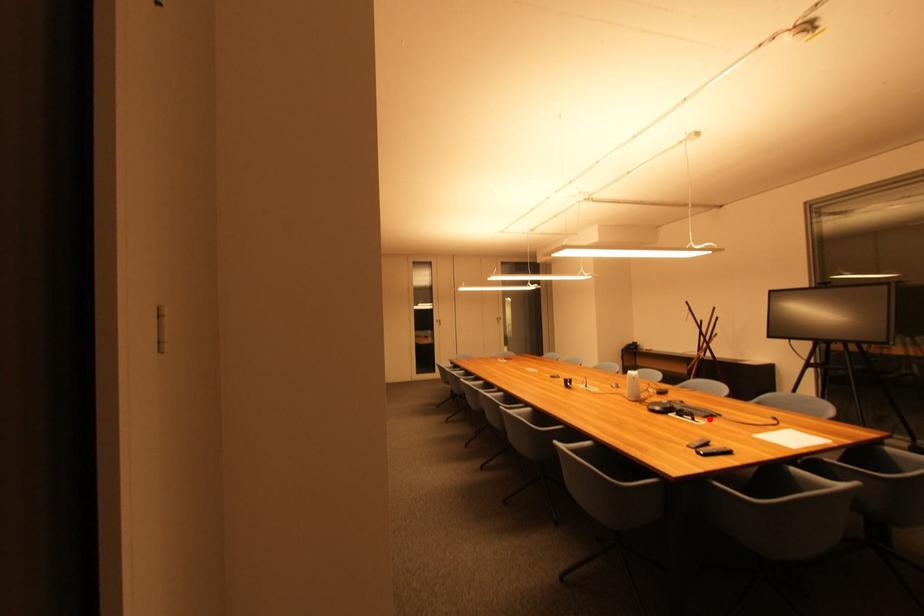
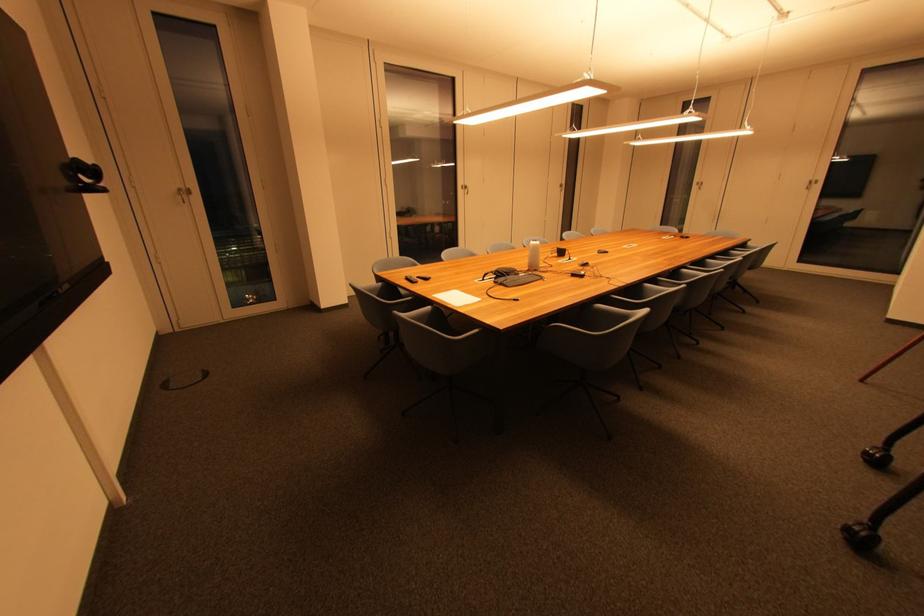
The point at the highlighted location is marked in the first image. Where is the corresponding point in the second image?

(500, 285)